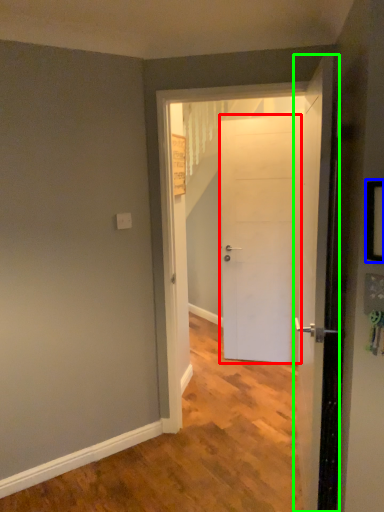
Question: Which object is positioned farthest from door (highlighted by a red box)? Select from picture frame (highlighted by a blue box) and door (highlighted by a green box).

Choices:
 (A) picture frame
 (B) door

Answer: (A)